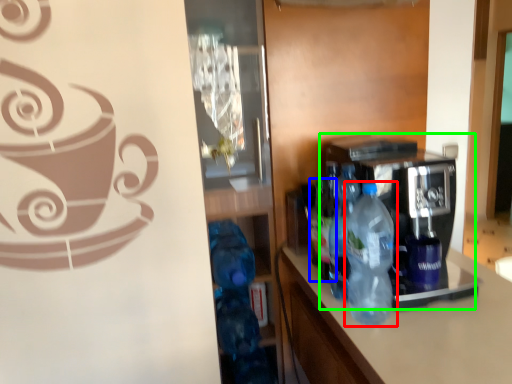
Question: Considering the real-world distances, which object is closest to bottle (highlighted by a red box)? bottle (highlighted by a blue box) or coffee machine (highlighted by a green box).

Choices:
 (A) bottle
 (B) coffee machine

Answer: (B)